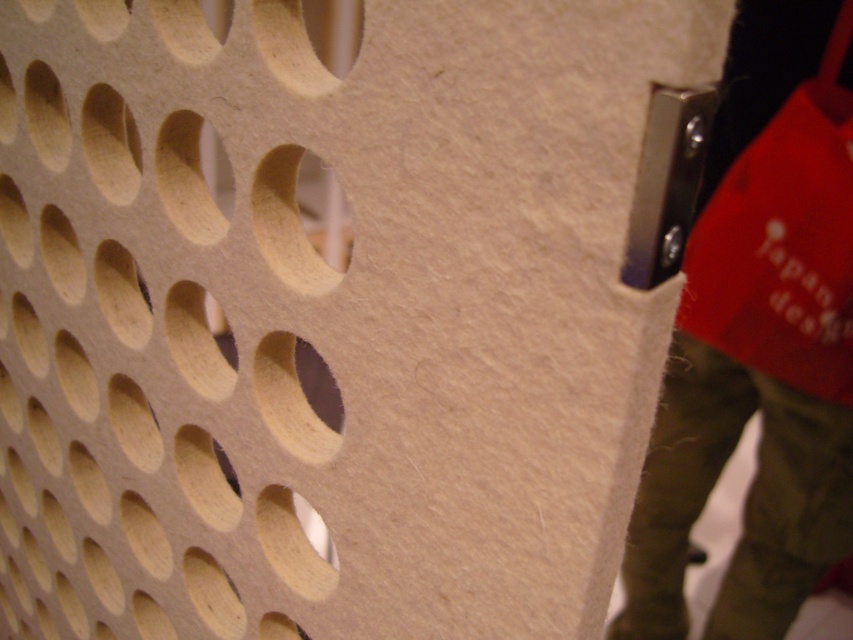
Question: Estimate the real-world distances between objects in this image. Which object is closer to the light brown cardboard hole at center?

Choices:
 (A) light brown wood hole at center
 (B) matte red fabric at right
 (C) matte wood hole at center
 (D) light wood/rough hole at center-left

Answer: (B)

Question: Does light brown cardboard hole at center appear over matte wood hole at center?

Choices:
 (A) no
 (B) yes

Answer: (B)

Question: Is the position of light wood/rough hole at center-left more distant than that of matte wood hole at center?

Choices:
 (A) yes
 (B) no

Answer: (B)

Question: Which object is closer to the camera taking this photo?

Choices:
 (A) light brown wood hole at center
 (B) light wood/rough hole at center-left
 (C) matte red fabric at right

Answer: (A)

Question: Is light brown cardboard hole at center smaller than light wood/rough hole at center-left?

Choices:
 (A) no
 (B) yes

Answer: (A)

Question: Which point is farther to the camera?

Choices:
 (A) matte red fabric at right
 (B) light brown wood hole at center
 (C) light brown cardboard hole at center

Answer: (C)